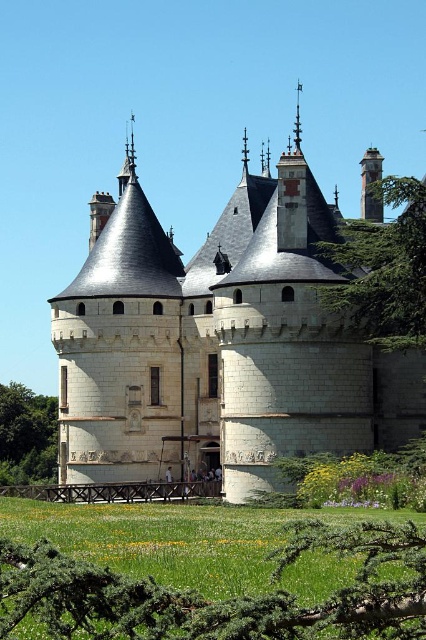
Image resolution: width=426 pixels, height=640 pixels. I want to click on white stone castle at center, so click(x=218, y=340).

Does white stone castle at center have a smaller size compared to green leafy tree at left?

Actually, white stone castle at center might be larger than green leafy tree at left.

Is point (83, 285) farther from camera compared to point (55, 428)?

No, (83, 285) is closer to viewer.

Identify the location of white stone castle at center. The width and height of the screenshot is (426, 640). (218, 340).

Does green grass at lower center have a greater height compared to green leafy tree at left?

No, green grass at lower center is not taller than green leafy tree at left.

Which is in front, point (353, 630) or point (37, 413)?

Point (353, 630) is in front.

At what (x,y) coordinates should I click in order to perform the action: click on green grass at lower center. Please return your answer as a coordinate pair (x, y). The image size is (426, 640). Looking at the image, I should click on (207, 596).

Does white stone castle at center come in front of dark gray stone tower at upper right?

No, it is not.

Is white stone castle at center bigger than dark gray stone tower at upper right?

Yes, white stone castle at center is bigger than dark gray stone tower at upper right.

Find the location of `white stone castle at center`. white stone castle at center is located at coordinates pos(218,340).